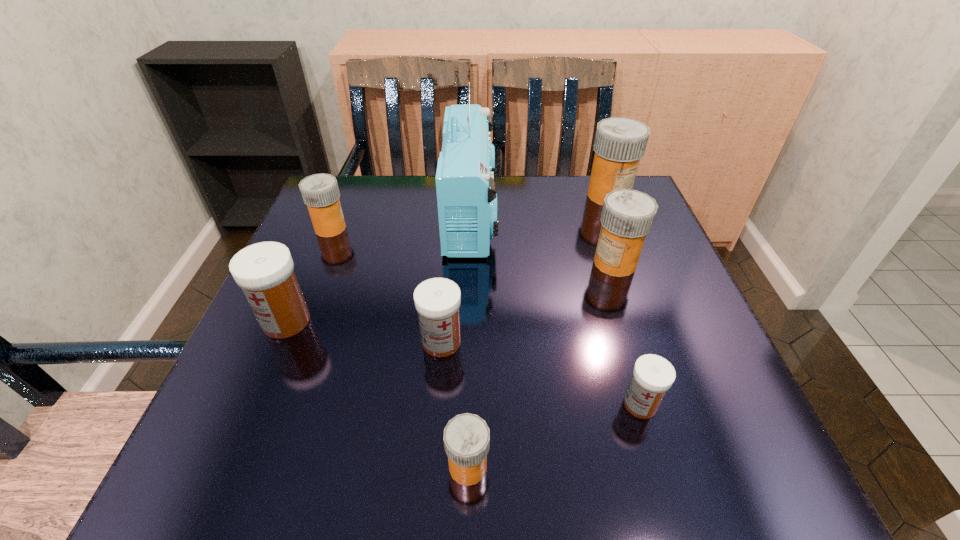
This screenshot has height=540, width=960. Find the location of `vacant space at the right edge`. vacant space at the right edge is located at coordinates (700, 405).

In the image, there is a desktop. What are the coordinates of `vacant space at the far left corner` in the screenshot? It's located at (314, 230).

The height and width of the screenshot is (540, 960). Find the location of `free point at the near left corner`. free point at the near left corner is located at coordinates (196, 458).

This screenshot has height=540, width=960. In order to click on vacant space at the near right corner of the desktop in this screenshot , I will do `click(693, 447)`.

Locate an element on the screen. vacant area between the radio receiver and the leftmost white medicine is located at coordinates (378, 268).

Locate an element on the screen. This screenshot has height=540, width=960. free space between the tallest object and the nearest medicine is located at coordinates (469, 341).

Find the location of a particular element. unoccupied area between the second white medicine from right to left and the third biggest orange medicine is located at coordinates pyautogui.click(x=386, y=285).

Find the location of a particular element. This screenshot has width=960, height=540. vacant space in between the second tallest object and the third orange medicine from right to left is located at coordinates (539, 331).

Where is `free space that is in between the second biggest white medicine and the third nearest orange medicine`? free space that is in between the second biggest white medicine and the third nearest orange medicine is located at coordinates (386, 285).

Image resolution: width=960 pixels, height=540 pixels. I want to click on vacant space that's between the second biggest white medicine and the fifth nearest medicine, so click(x=528, y=302).